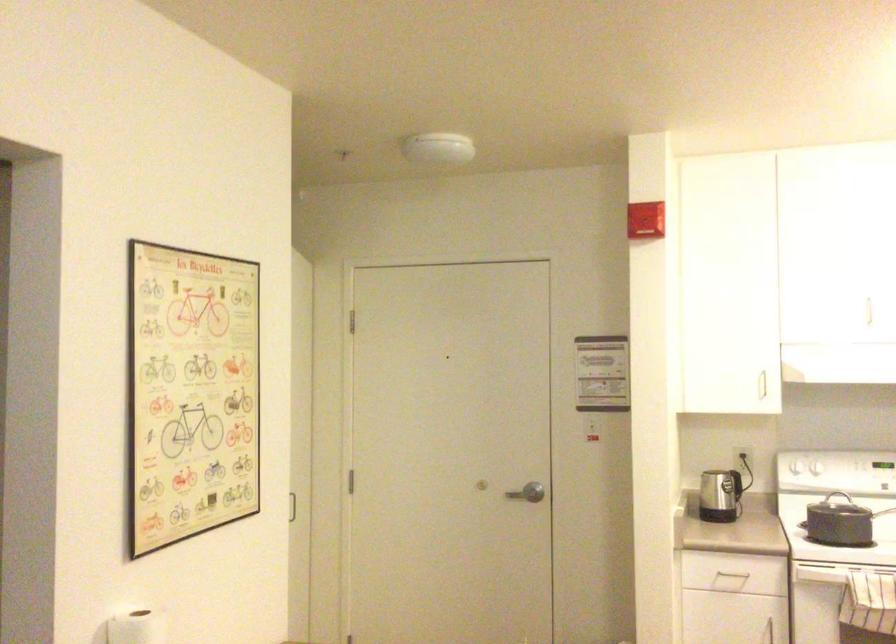
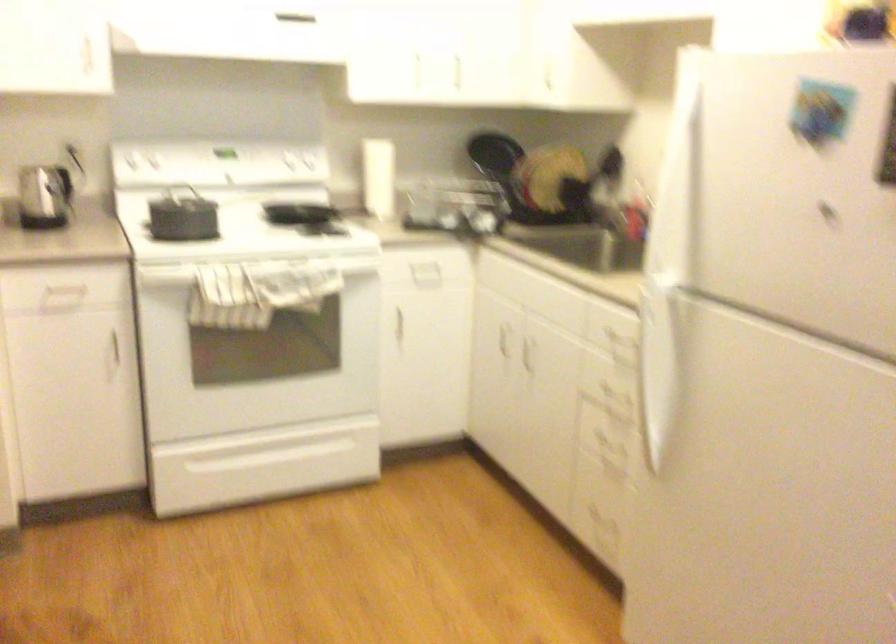
In the second image, find the point that corresponds to [821,473] in the first image.

(158, 171)